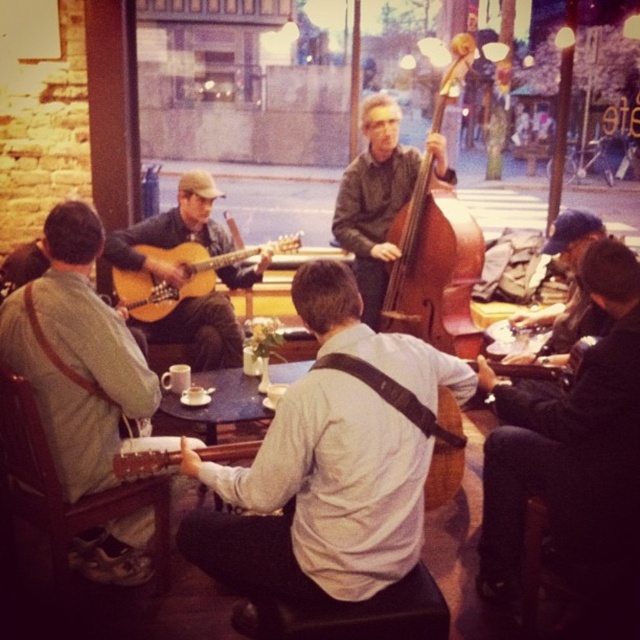
Which of these two, black leather jacket at lower right or black wood table at center, stands shorter?

black wood table at center

Who is positioned more to the right, black leather jacket at lower right or black wood table at center?

black leather jacket at lower right

Find the location of a particular element. black leather jacket at lower right is located at coordinates (570, 440).

Does black leather jacket at lower right appear on the right side of matte wood guitar at center-left?

Indeed, black leather jacket at lower right is positioned on the right side of matte wood guitar at center-left.

From the picture: Who is more forward, [529,477] or [154,248]?

Point [529,477]

I want to click on black leather jacket at lower right, so click(570, 440).

Which is more to the right, white matte guitar at center or matte brown guitar at left?

Positioned to the right is white matte guitar at center.

Is white matte guitar at center thinner than matte brown guitar at left?

In fact, white matte guitar at center might be wider than matte brown guitar at left.

Does point (452, 388) lie in front of point (49, 349)?

No, it is not.

At what (x,y) coordinates should I click in order to perform the action: click on white matte guitar at center. Please return your answer as a coordinate pair (x, y). The width and height of the screenshot is (640, 640). Looking at the image, I should click on (316, 497).